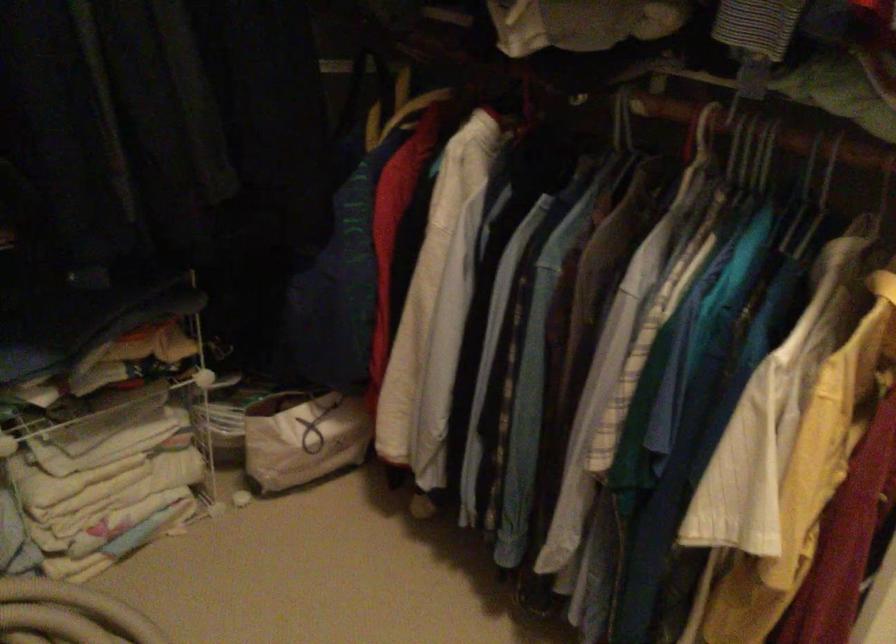
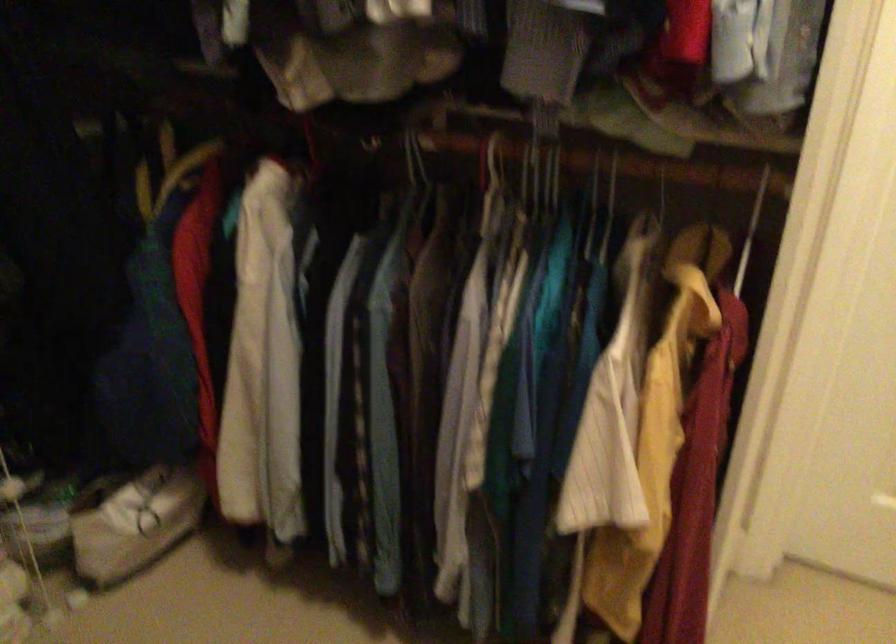
Question: The camera is either moving clockwise (left) or counter-clockwise (right) around the object. The first image is from the beginning of the video and the second image is from the end. Is the camera moving left or right when shooting the video?

Choices:
 (A) Left
 (B) Right

Answer: (A)